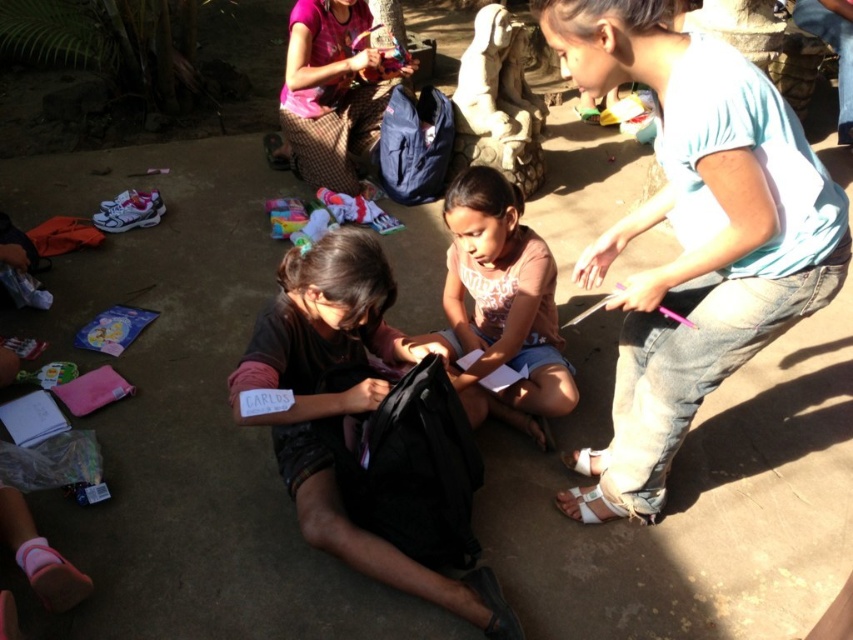
You are a photographer trying to capture a candid shot of the scene. The blue jeans at lower right and the pink fabric at upper center are in your frame. Based on their heights, which object should you focus on first to ensure both are in focus?

The blue jeans at lower right has a greater height compared to pink fabric at upper center. To ensure both are in focus, you should focus on the blue jeans at lower right first since it is taller and likely closer to the camera.

You are standing at the center of the image and want to find the blue jeans at lower right. In which direction should you move your gaze to locate them?

To locate the blue jeans at lower right, you should move your gaze towards the lower right direction since their 2D location is at point (695,236).